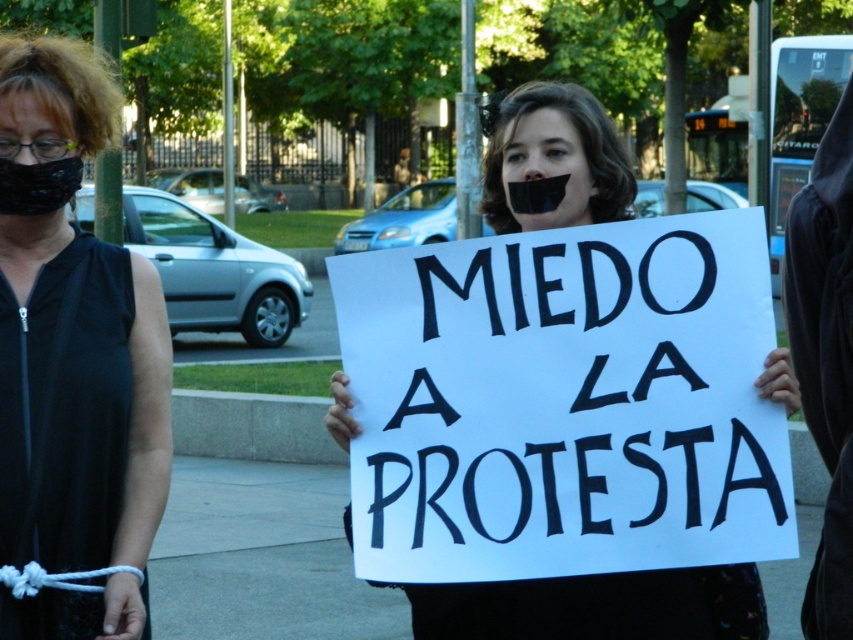
Describe the element at coordinates (73, 362) in the screenshot. I see `black fabric mask at left` at that location.

Is black fabric mask at left bigger than white paper sign at center?

Yes.

Is point (132, 422) less distant than point (497, 109)?

Yes, point (132, 422) is closer to viewer.

At what (x,y) coordinates should I click in order to perform the action: click on black fabric mask at left. Please return your answer as a coordinate pair (x, y). The height and width of the screenshot is (640, 853). Looking at the image, I should click on (73, 362).

Is point (714, 600) less distant than point (833, 432)?

Yes, it is.

The width and height of the screenshot is (853, 640). Find the location of `white paper sign at center`. white paper sign at center is located at coordinates (596, 605).

Is point (675, 620) positioned in front of point (815, 378)?

Yes.

The height and width of the screenshot is (640, 853). In order to click on white paper sign at center in this screenshot , I will do `click(596, 605)`.

Does black fabric mask at left come behind black fabric at center?

That is True.

Is black fabric mask at left to the left of black fabric at center from the viewer's perspective?

Correct, you'll find black fabric mask at left to the left of black fabric at center.

This screenshot has width=853, height=640. Find the location of `black fabric mask at left`. black fabric mask at left is located at coordinates (73, 362).